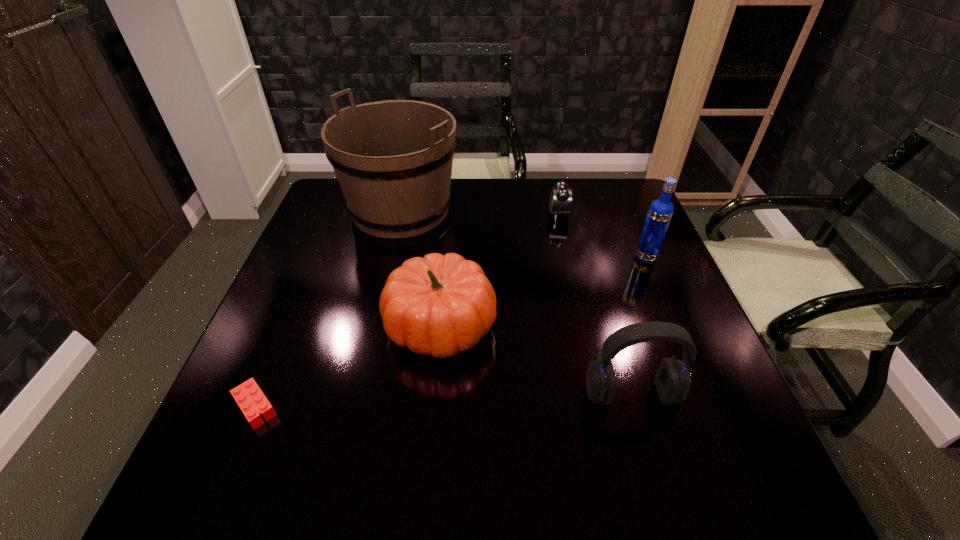
This screenshot has height=540, width=960. What are the coordinates of `vodka that is at the right edge` in the screenshot? It's located at (660, 212).

The width and height of the screenshot is (960, 540). I want to click on headset that is positioned at the right edge, so click(672, 380).

Where is `object that is positioned at the far left corner`? object that is positioned at the far left corner is located at coordinates (393, 159).

Identify the location of vacant space at the far edge of the desktop. (483, 207).

The width and height of the screenshot is (960, 540). Find the location of `vacant space at the near edge of the desktop`. vacant space at the near edge of the desktop is located at coordinates (590, 495).

In order to click on free point at the left edge in this screenshot , I will do `click(314, 225)`.

Identify the location of free space at the right edge of the desktop. This screenshot has width=960, height=540. (638, 354).

Find the location of a particular element. This screenshot has width=960, height=540. empty space between the tallest object and the fifth shortest object is located at coordinates (523, 234).

Identify the location of free space between the alarm clock and the third nearest object. The height and width of the screenshot is (540, 960). (499, 271).

Locate an element on the screen. free space between the headset and the pumpkin is located at coordinates (536, 360).